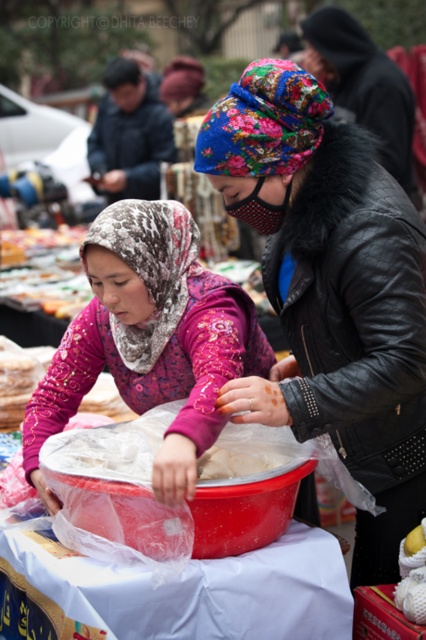
Question: Does leather jacket at center have a greater width compared to fluffy black jacket at upper right?

Choices:
 (A) no
 (B) yes

Answer: (A)

Question: Estimate the real-world distances between objects in this image. Which object is farther from the dark blue fabric headscarf at upper left?

Choices:
 (A) leather jacket at center
 (B) white paper tablecloth at lower center
 (C) fluffy black jacket at upper right

Answer: (B)

Question: Is pink floral fabric at center to the left of fluffy black jacket at upper right from the viewer's perspective?

Choices:
 (A) no
 (B) yes

Answer: (B)

Question: Among these objects, which one is farthest from the camera?

Choices:
 (A) pink floral fabric at center
 (B) white paper tablecloth at lower center

Answer: (A)

Question: Can you confirm if leather jacket at center is positioned to the left of white paper tablecloth at lower center?

Choices:
 (A) yes
 (B) no

Answer: (B)

Question: Which is nearer to the leather jacket at center?

Choices:
 (A) pink floral fabric at center
 (B) white paper tablecloth at lower center

Answer: (A)